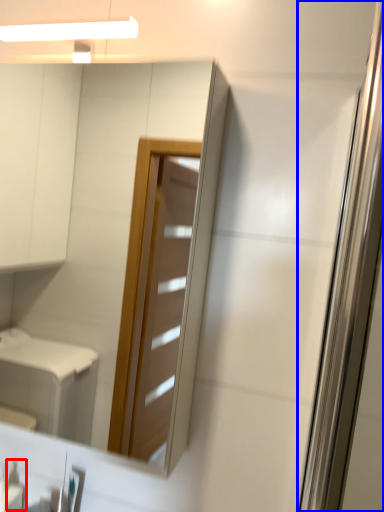
Question: Which object is closer to the camera taking this photo, toiletry (highlighted by a red box) or screen door (highlighted by a blue box)?

Choices:
 (A) toiletry
 (B) screen door

Answer: (B)